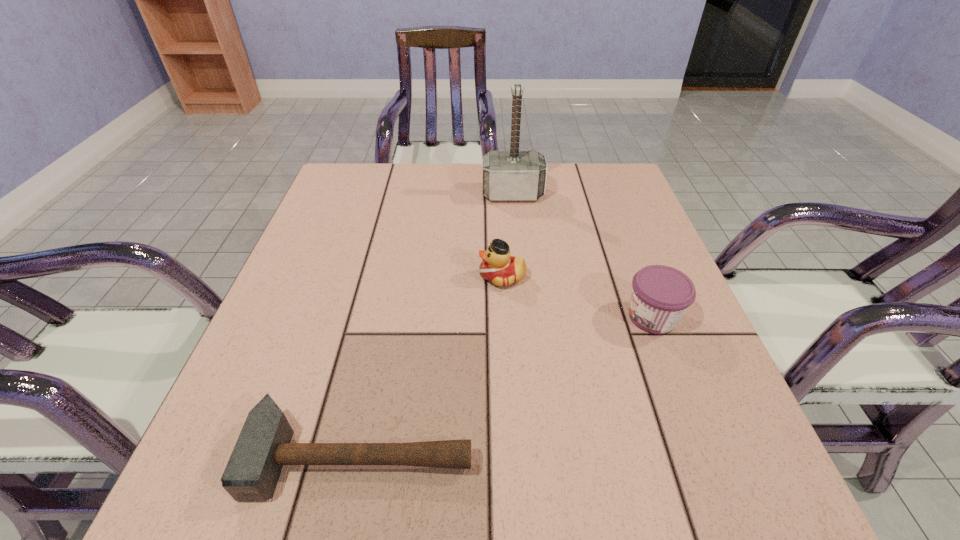
In the image, there is a desktop. Where is `free space at the left edge`? The height and width of the screenshot is (540, 960). free space at the left edge is located at coordinates (291, 326).

I want to click on vacant position at the right edge of the desktop, so click(601, 218).

Identify the location of free spot at the far left corner of the desktop. (372, 184).

Locate an element on the screen. The height and width of the screenshot is (540, 960). vacant space at the near left corner of the desktop is located at coordinates (207, 463).

In the image, there is a desktop. Where is `free space at the far right corner`? Image resolution: width=960 pixels, height=540 pixels. free space at the far right corner is located at coordinates (629, 182).

Where is `vacant region between the second nearest object and the shortest object`? vacant region between the second nearest object and the shortest object is located at coordinates point(507,386).

Identify the location of free spot between the duck and the farthest object. (508, 235).

You are a GUI agent. You are given a task and a screenshot of the screen. Output one action in this format:
    pyautogui.click(x=<x>, y=<y>)
    Task: Click on the empty space between the shortest object and the rightmost object
    
    Given the screenshot: What is the action you would take?
    pyautogui.click(x=507, y=386)

At what (x,y) coordinates should I click in order to perform the action: click on free space between the nearest object and the rightmost object. Please return your answer as a coordinate pair (x, y). Image resolution: width=960 pixels, height=540 pixels. Looking at the image, I should click on (507, 386).

The height and width of the screenshot is (540, 960). I want to click on vacant space that is in between the shorter hammer and the second farthest object, so [432, 366].